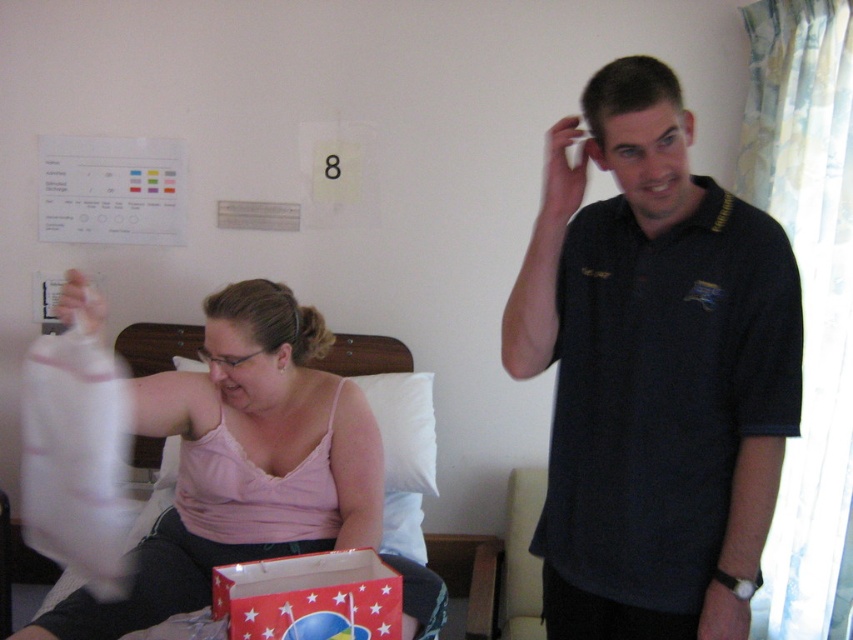
You are a healthcare worker entering the hospital room and need to reach the point marked at coordinates (743,502). Considering the woman sitting on the bed and the objects in the room, can you safely approach that point without disturbing her?

The point at coordinates (743,502) is 1.30 meters away from the camera. Since the woman is sitting on the edge of the bed and holding a plastic bag, there is likely enough space to safely approach the point without disturbing her, provided the path is clear.

You are a nurse entering the room and need to place a new patient chart on the bed. The chart is too large to fit on the bed between the dark blue polo shirt at center and the red paper bag at lower center. Which object should you move to make space?

The dark blue polo shirt at center is to the right of the red paper bag at lower center. To make space, move the dark blue polo shirt at center to the left or the red paper bag at lower center to the right.

Based on the photo, you are a nurse entering the hospital room and need to place a medical kit on the bed. The medical kit is 18 inches long. There is a dark blue polo shirt at center and a red paper bag at lower center on the bed. Can the medical kit fit between them without overlapping?

The distance between the dark blue polo shirt at center and the red paper bag at lower center is 18.31 inches. Since the medical kit is 18 inches long, it can fit between them without overlapping.